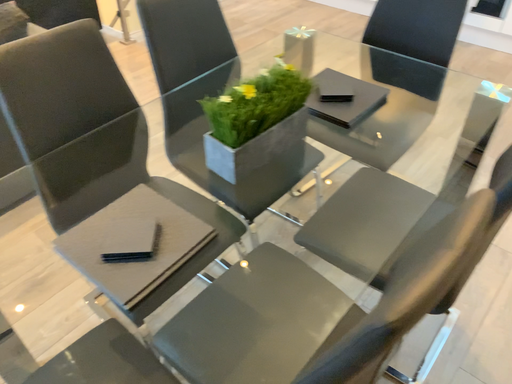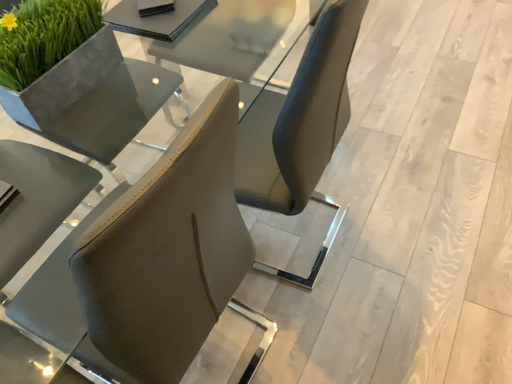
Question: How did the camera likely rotate when shooting the video?

Choices:
 (A) rotated right
 (B) rotated left

Answer: (A)